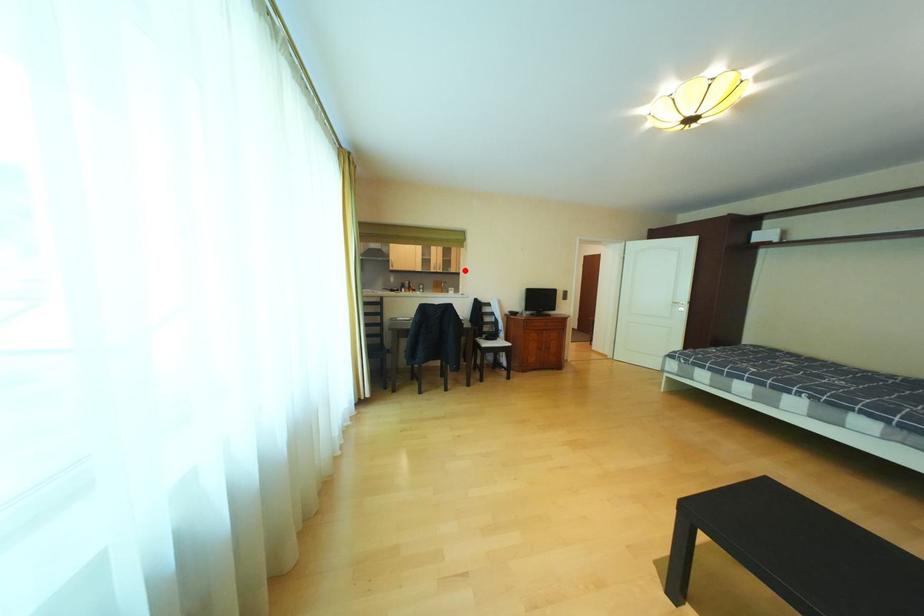
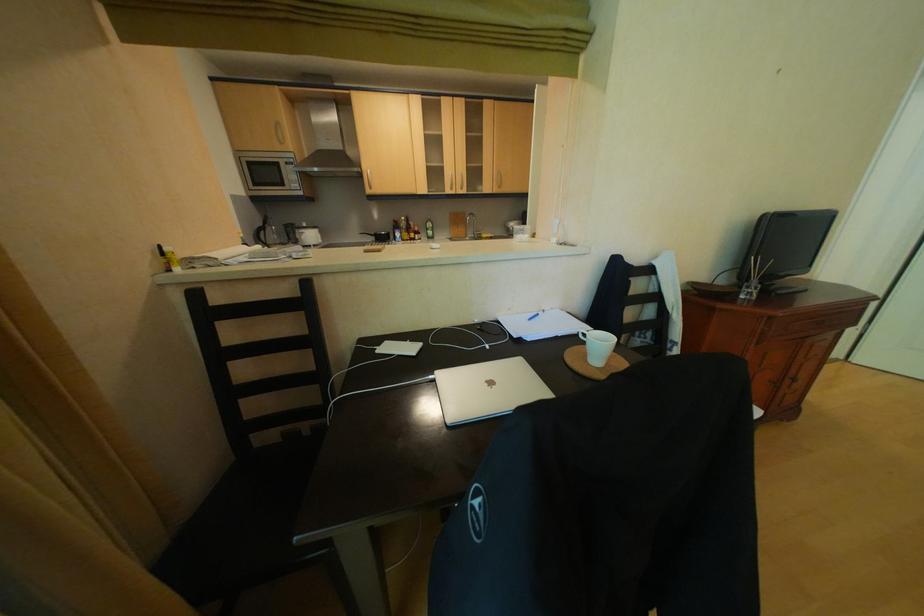
Question: A red point is marked in image1. In image2, is the corresponding 3D point closer to the camera or farther? Reply with the corresponding letter.

Choices:
 (A) The corresponding 3D point is closer.
 (B) The corresponding 3D point is farther.

Answer: (A)